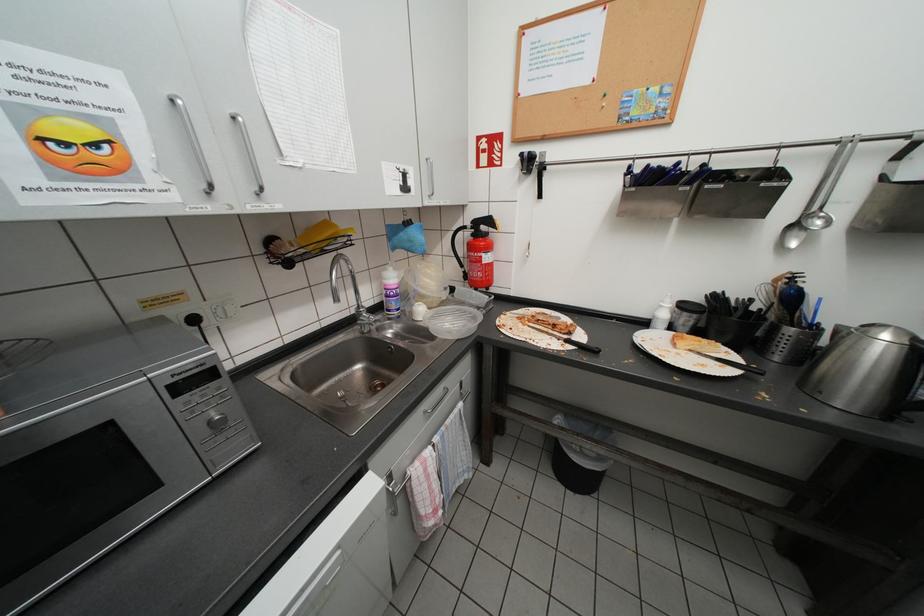
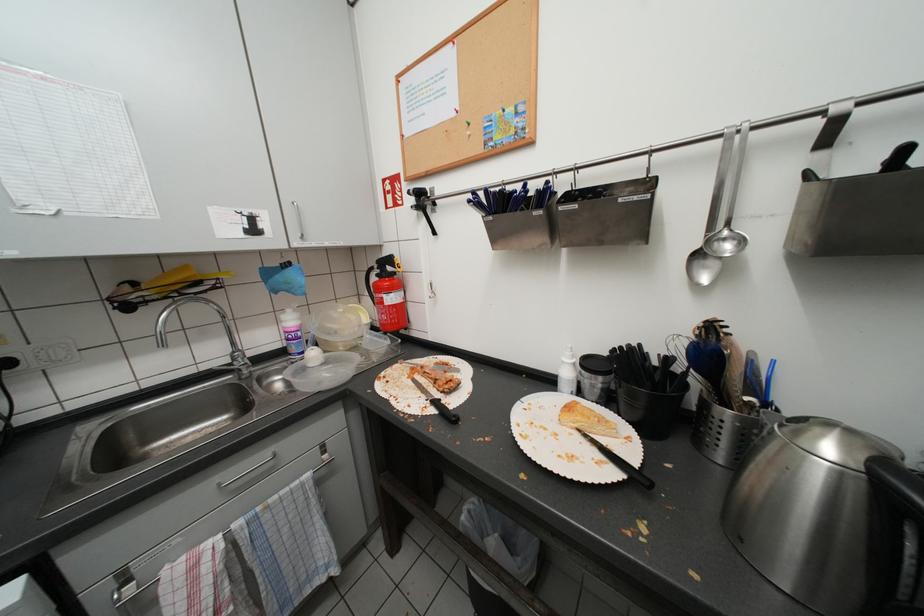
Question: The first image is from the beginning of the video and the second image is from the end. How did the camera likely rotate when shooting the video?

Choices:
 (A) Left
 (B) Right
 (C) Up
 (D) Down

Answer: (A)